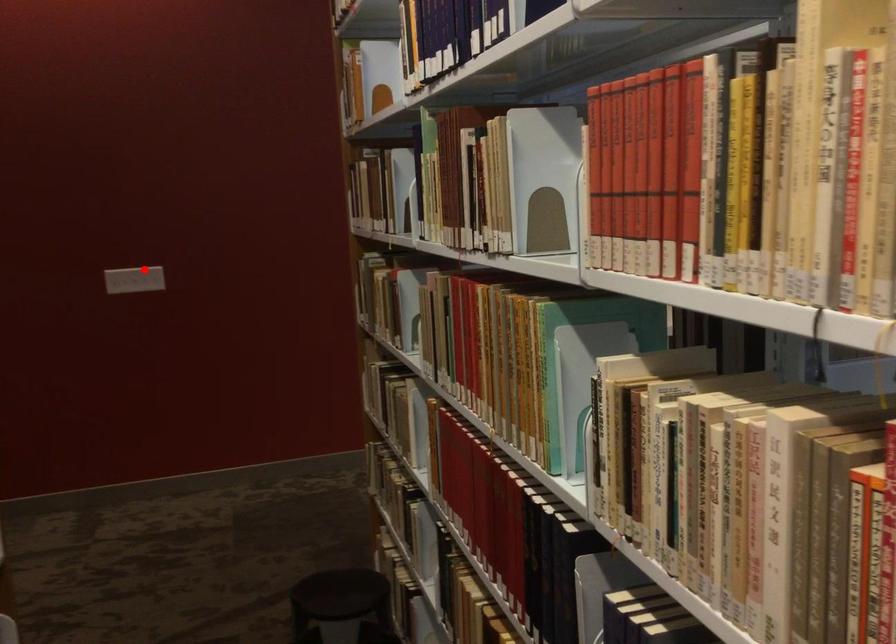
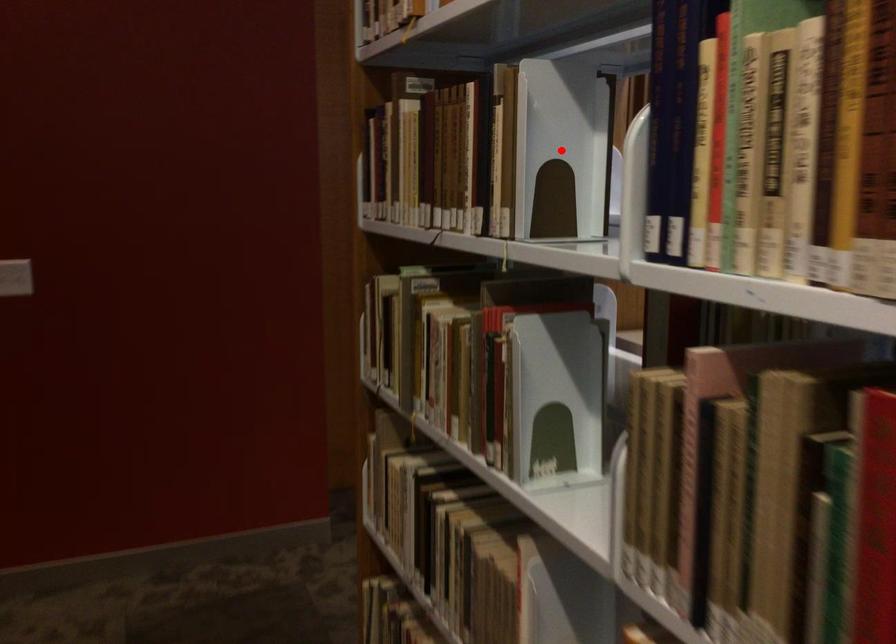
I am providing you with two images of the same scene from different viewpoints. A red point is marked on the first image and another point is marked on the second image. Is the red point in image1 aligned with the point shown in image2?

No